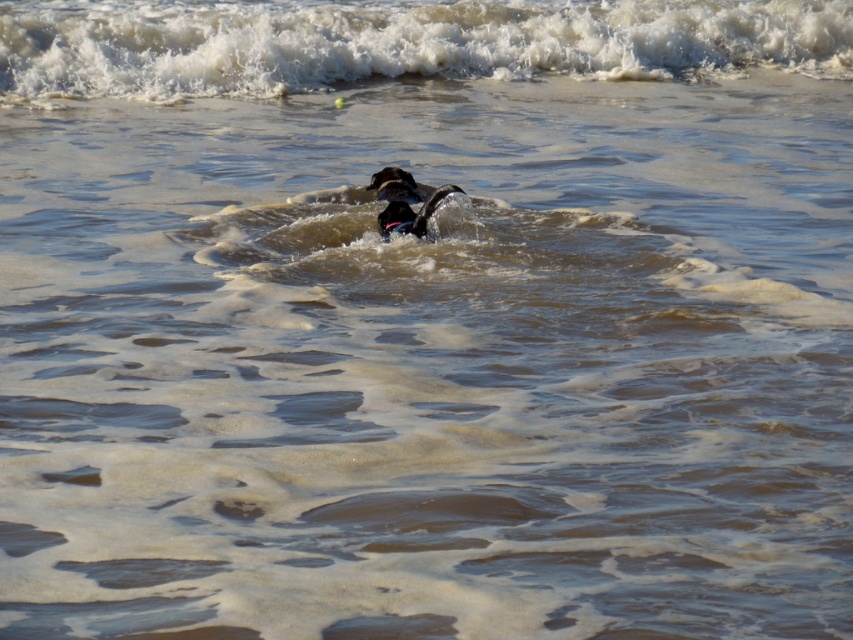
Question: Is white frothy wave at upper center wider than shiny black dog at center?

Choices:
 (A) no
 (B) yes

Answer: (B)

Question: Which of the following is the closest to the observer?

Choices:
 (A) shiny black dog at center
 (B) black matte dog at center

Answer: (A)

Question: Which point is farther to the camera?

Choices:
 (A) (9, 97)
 (B) (419, 193)
 (C) (444, 195)

Answer: (A)

Question: Where is white frothy wave at upper center located in relation to black matte dog at center in the image?

Choices:
 (A) left
 (B) right

Answer: (B)

Question: Among these objects, which one is farthest from the camera?

Choices:
 (A) shiny black dog at center
 (B) white frothy wave at upper center
 (C) black matte dog at center

Answer: (B)

Question: Does white frothy wave at upper center lie behind shiny black dog at center?

Choices:
 (A) no
 (B) yes

Answer: (B)